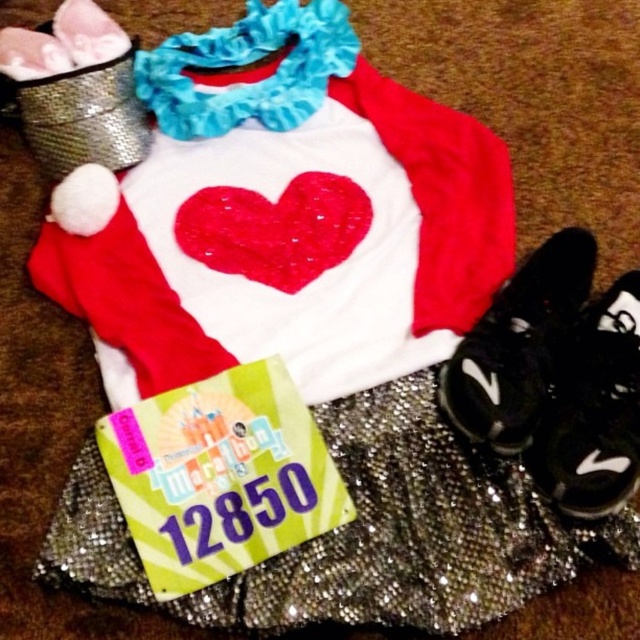
Question: Which object appears closest to the camera in this image?

Choices:
 (A) black synthetic shoe at lower right
 (B) glittery sequined ballet skirt at center
 (C) black mesh shoe at lower right

Answer: (B)

Question: Which point appears farthest from the camera in this image?

Choices:
 (A) (362, 208)
 (B) (572, 278)
 (C) (582, 346)

Answer: (A)

Question: Considering the relative positions of glittery sequined ballet skirt at center and shiny sequined heart at center in the image provided, where is glittery sequined ballet skirt at center located with respect to shiny sequined heart at center?

Choices:
 (A) right
 (B) left

Answer: (A)

Question: Among these points, which one is nearest to the camera?

Choices:
 (A) (429, 588)
 (B) (323, 205)

Answer: (A)

Question: Is the position of glittery sequined ballet skirt at center more distant than that of shiny sequined heart at center?

Choices:
 (A) yes
 (B) no

Answer: (B)

Question: Is glittery sequined ballet skirt at center below black synthetic shoe at lower right?

Choices:
 (A) yes
 (B) no

Answer: (A)